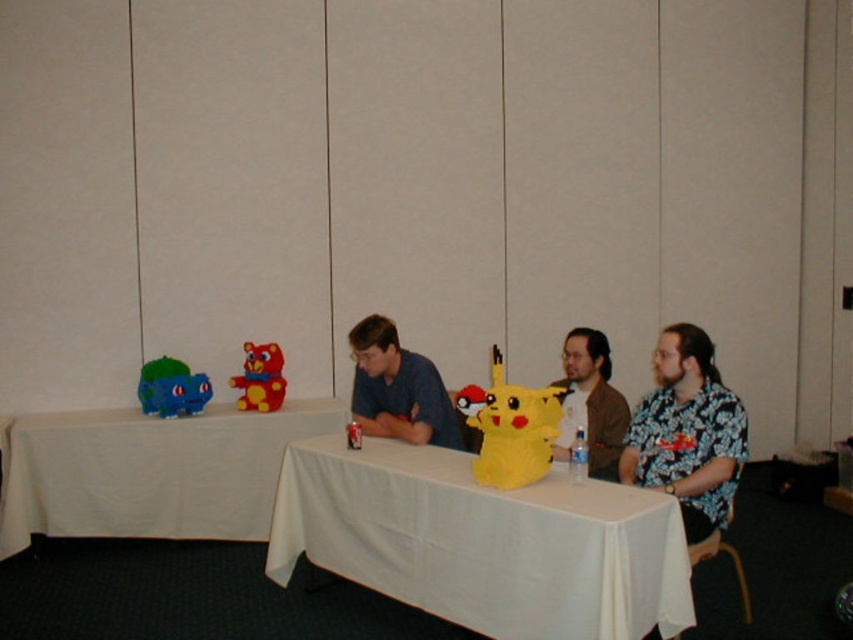
Question: Which of the following is the closest to the observer?

Choices:
 (A) (28, 460)
 (B) (410, 387)

Answer: (B)

Question: Can you confirm if white cloth table at center is positioned to the left of yellow plush toy at center?

Choices:
 (A) yes
 (B) no

Answer: (A)

Question: Does floral shirt at center have a greater width compared to matte blue shirt at center?

Choices:
 (A) no
 (B) yes

Answer: (A)

Question: Which of the following is the closest to the observer?

Choices:
 (A) yellow plush toy at center
 (B) matte blue plush at left
 (C) brown textured shirt at center
 (D) matte blue shirt at center

Answer: (A)

Question: Which point appears farthest from the camera in this image?

Choices:
 (A) (647, 445)
 (B) (448, 461)
 (C) (90, 493)

Answer: (C)

Question: Is matte blue plush at left bigger than plush teddy bear at center?

Choices:
 (A) yes
 (B) no

Answer: (B)